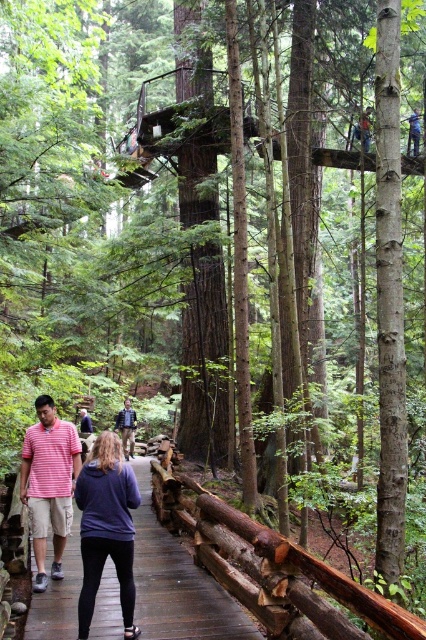
Question: Considering the real-world distances, which object is farthest from the dark blue jacket at center?

Choices:
 (A) dark blue sweater at center
 (B) brown rough wooden fence at center
 (C) striped cotton shirt at center
 (D) brown wooden path at lower center

Answer: (A)

Question: From the image, what is the correct spatial relationship of brown rough wooden fence at center in relation to striped cotton shirt at center?

Choices:
 (A) right
 (B) left

Answer: (A)

Question: Among these objects, which one is nearest to the camera?

Choices:
 (A) brown rough wooden fence at center
 (B) dark blue sweater at center
 (C) brown wooden path at lower center

Answer: (B)

Question: Among these objects, which one is farthest from the camera?

Choices:
 (A) brown rough wooden fence at center
 (B) dark blue jacket at center

Answer: (B)

Question: Is dark blue jacket at center bigger than blue fabric jacket at upper center?

Choices:
 (A) yes
 (B) no

Answer: (B)

Question: Can you confirm if brown rough wooden fence at center is bigger than dark blue sweater at center?

Choices:
 (A) no
 (B) yes

Answer: (A)